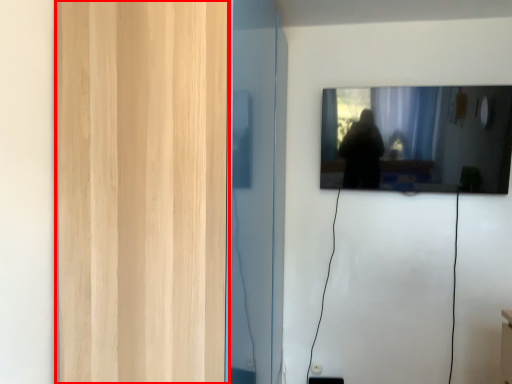
Question: Observing the image, what is the correct spatial positioning of glass door (annotated by the red box) in reference to mirror?

Choices:
 (A) left
 (B) right

Answer: (A)